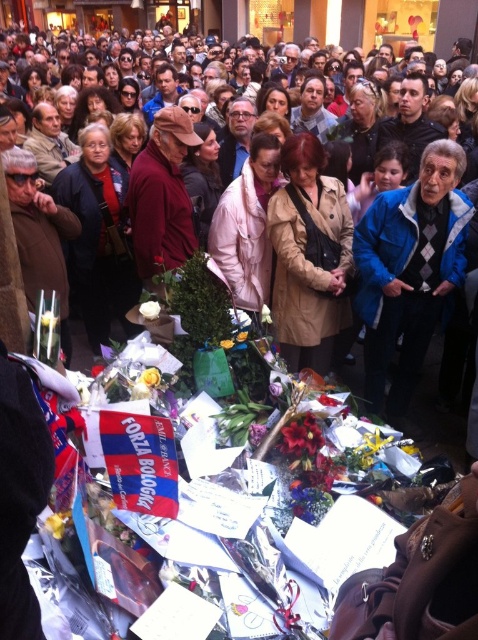
You are a photographer trying to capture a clear shot of the yellow fabric flower at lower center without the blue jacket at center blocking it. Based on their positions and sizes, is this possible?

The blue jacket at center might be wider than yellow fabric flower at lower center, so there is a possibility that the blue jacket at center could block the view of the yellow fabric flower at lower center. To ensure a clear shot, reposition the camera angle or move closer to avoid obstruction.

You are organizing a memorial display and need to place a small decorative item between the white matte rose at center and the white matte flower at lower left. Considering their sizes, where should you place the item to ensure it is visible and not obstructed?

Since the white matte rose at center is larger than the white matte flower at lower left, placing the small decorative item closer to the white matte flower at lower left would ensure it remains visible and unobstructed by the taller rose.